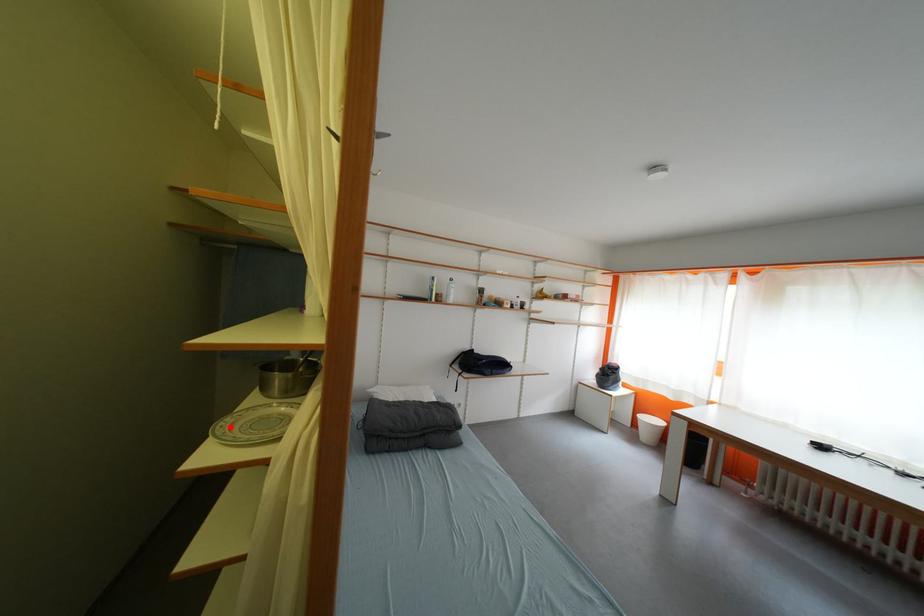
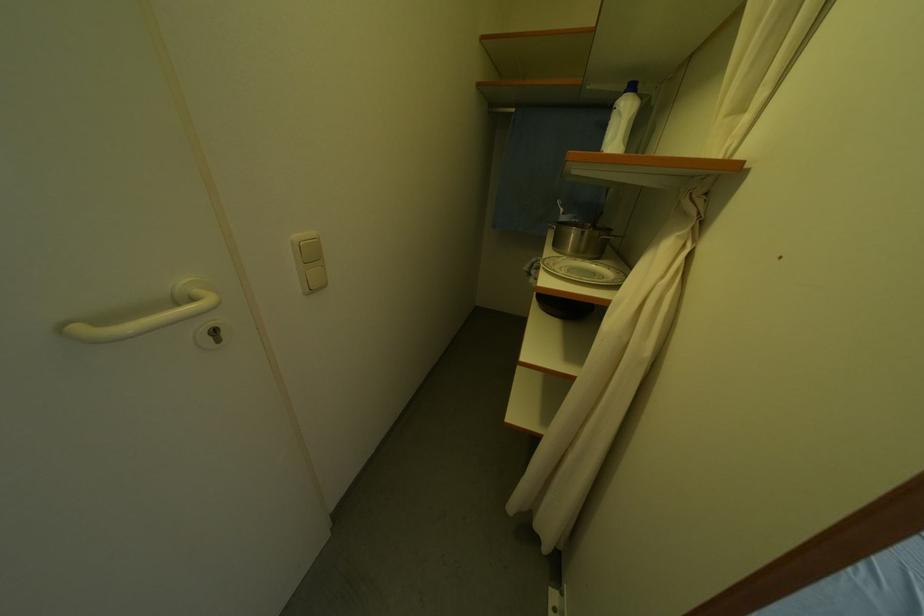
Question: I am providing you with two images of the same scene from different viewpoints. Image1 has a red point marked. In image2, the corresponding 3D location appears at what relative position? Reply with the corresponding letter.

Choices:
 (A) Closer
 (B) Farther

Answer: (A)